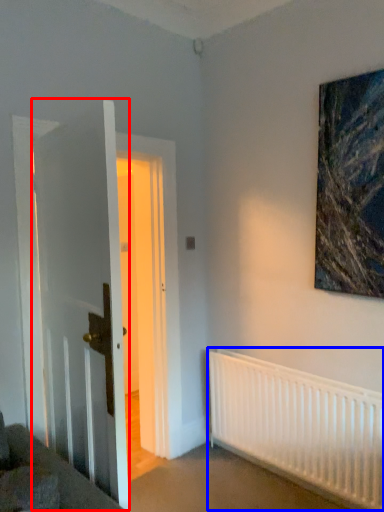
Question: Among these objects, which one is nearest to the camera, door (highlighted by a red box) or radiator (highlighted by a blue box)?

Choices:
 (A) door
 (B) radiator

Answer: (A)